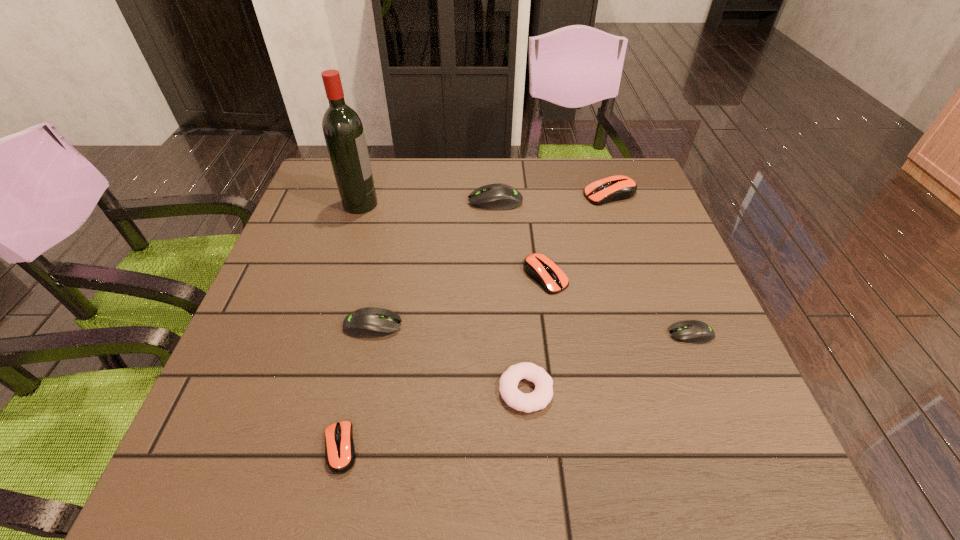
Locate an element on the screen. vacant space that satisfies the following two spatial constraints: 1. on the back side of the doughnut; 2. on the left side of the second biggest orange computer mouse is located at coordinates (516, 276).